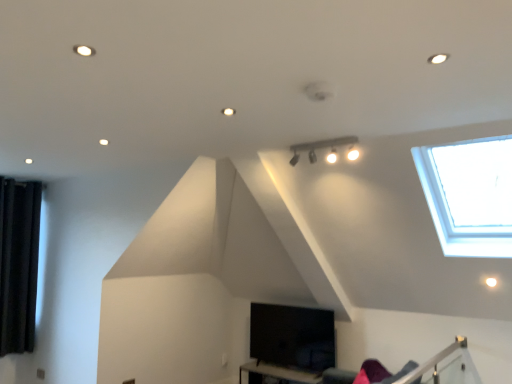
Question: Considering the positions of black velvet curtain at left and black matte table at lower center in the image, is black velvet curtain at left wider or thinner than black matte table at lower center?

Choices:
 (A) wide
 (B) thin

Answer: (B)

Question: Would you say black velvet curtain at left is inside or outside black matte table at lower center?

Choices:
 (A) outside
 (B) inside

Answer: (A)

Question: Which object is positioned farthest from the matte black track lighting at upper center?

Choices:
 (A) black velvet curtain at left
 (B) black matte table at lower center

Answer: (A)

Question: Which object is the farthest from the black velvet curtain at left?

Choices:
 (A) matte black track lighting at upper center
 (B) black matte table at lower center

Answer: (A)